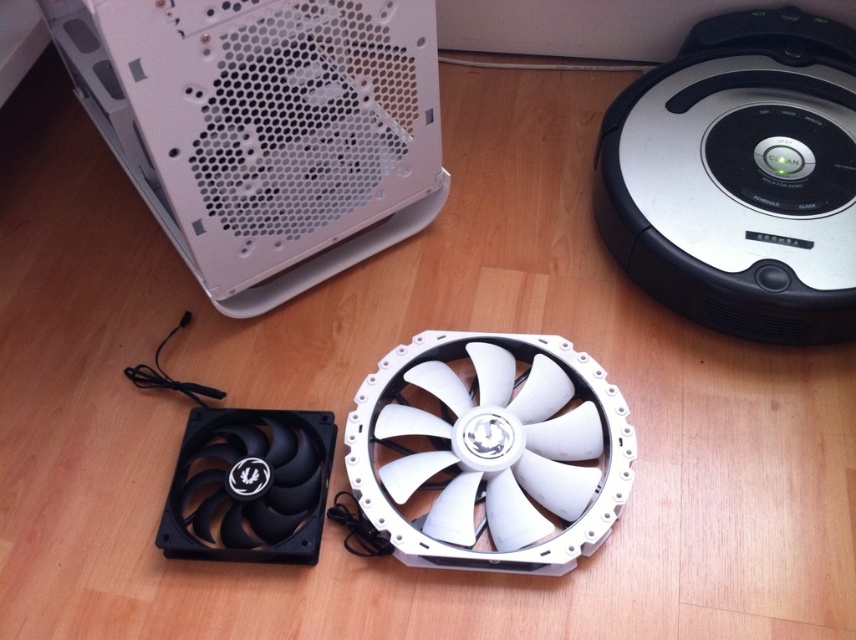
You are setting up a desk and need to place the white matte computer case at upper left and the black plastic fan at lower left. Given that the desk has limited space, which object should you prioritize placing first to ensure both fit properly?

The white matte computer case at upper left is larger in size than the black plastic fan at lower left, so you should prioritize placing the white matte computer case at upper left first to accommodate its larger size before positioning the smaller fan.

You are a technician standing 3 feet away from the camera position. You need to reach the white matte computer case at upper left to perform maintenance. Can you comfortably reach it without moving your position?

The white matte computer case at upper left is 31.42 inches away from the camera. Since you are standing 3 feet away from the camera position, which is 36 inches, you can comfortably reach it without moving your position.

You are standing in front of the wooden floor with two computer fans and a robotic. You want to place a new fan exactly 1.5 meters away from the point labeled point (x=431, y=164). Can you determine if this placement is possible within the visible area of the scene?

The distance between point (x=431, y=164) and the viewer is 1.20 meters. Since the desired placement is 1.5 meters away from the point, which is beyond the current viewer distance, it might not be possible within the visible area unless the scene extends further. However, without additional information about the scene boundaries, it is uncertain.